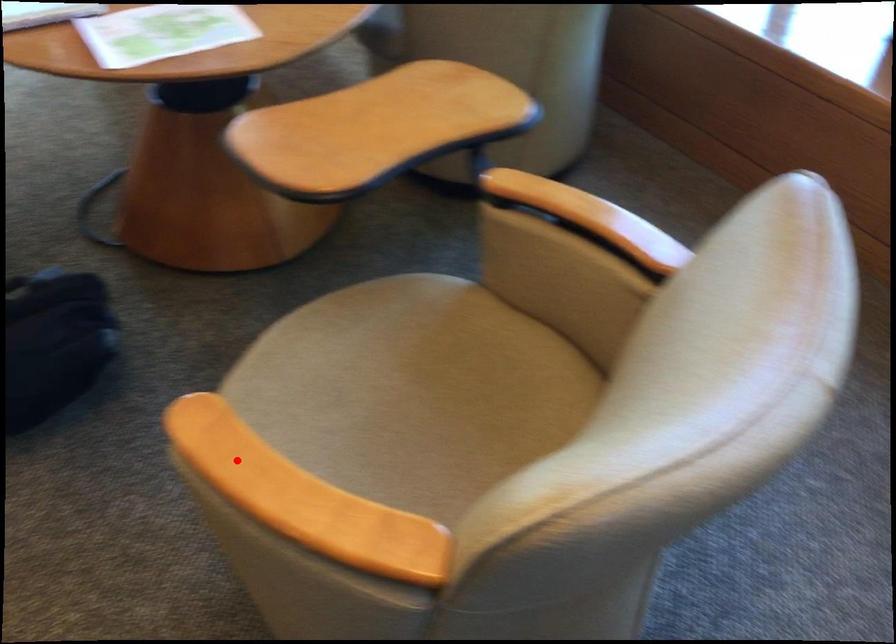
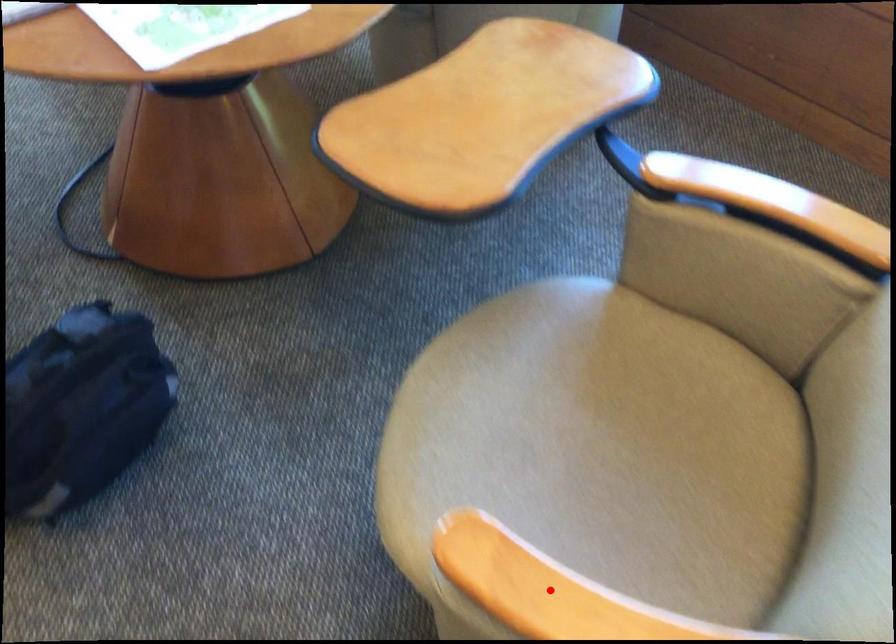
Looking at this image, I am providing you with two images of the same scene from different viewpoints. A red point is marked on the first image and another point is marked on the second image. Are the points marked in image1 and image2 representing the same 3D position?

Yes